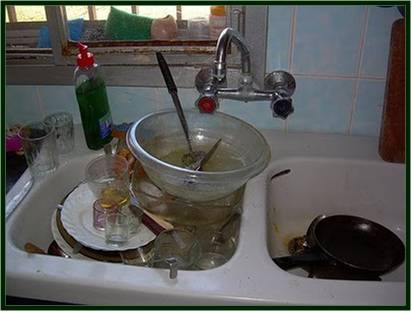
Image resolution: width=412 pixels, height=312 pixels. Find the location of `backsplash`. backsplash is located at coordinates (334, 100).